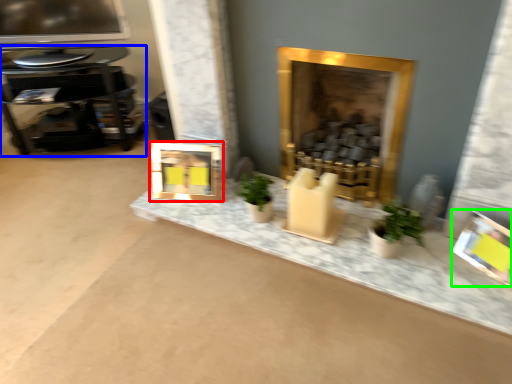
Question: Which object is the closest to the picture frame (highlighted by a red box)? Choose among these: table (highlighted by a blue box) or picture frame (highlighted by a green box).

Choices:
 (A) table
 (B) picture frame

Answer: (A)